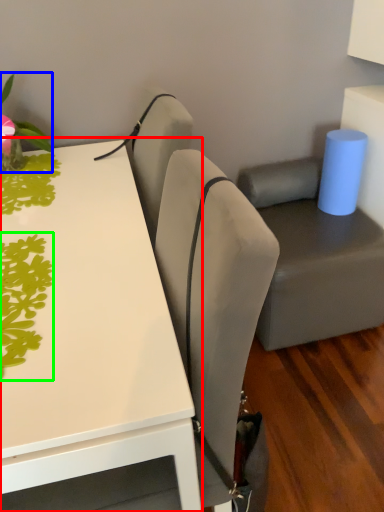
Question: Which object is the farthest from table (highlighted by a red box)? Choose among these: plant (highlighted by a blue box) or plant (highlighted by a green box).

Choices:
 (A) plant
 (B) plant

Answer: (A)